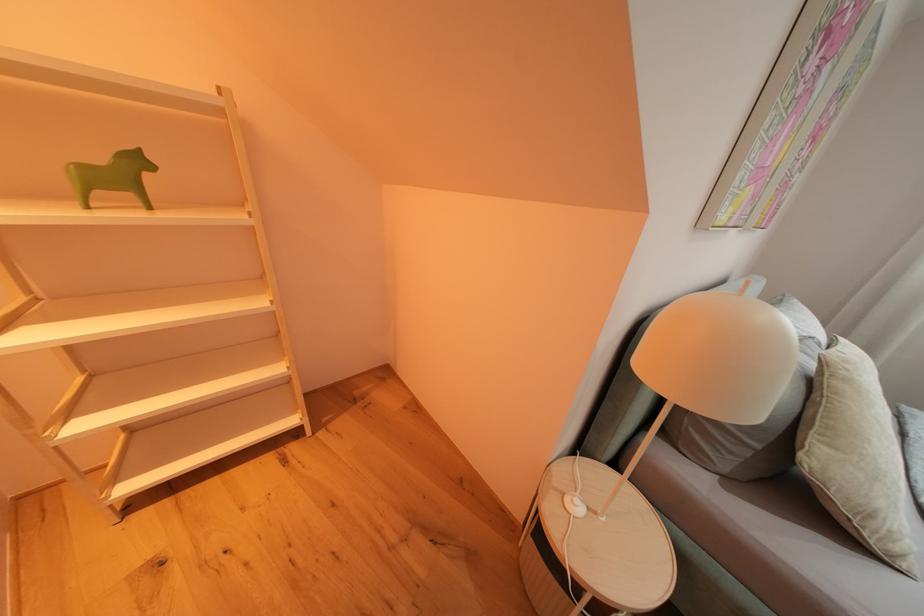
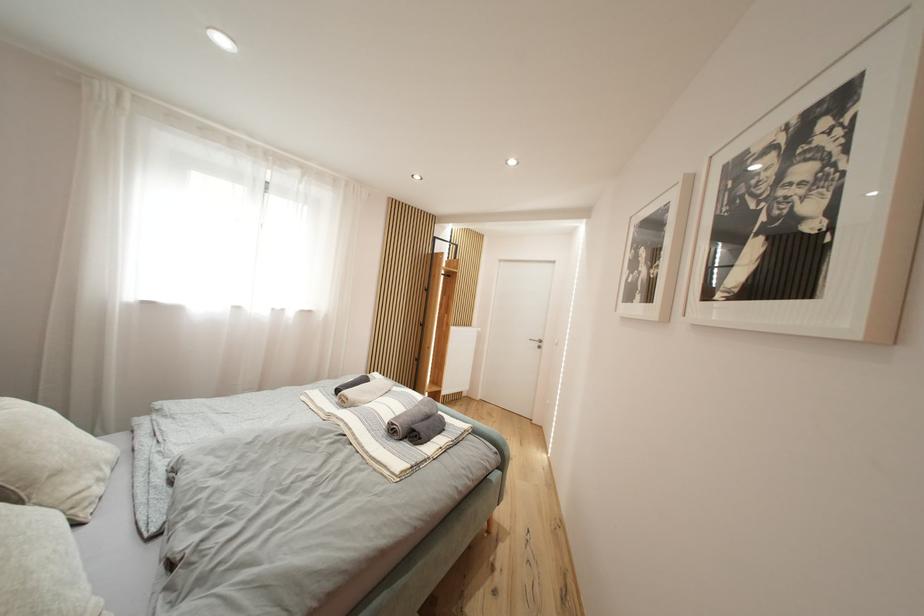
Based on the continuous images, in which direction is the camera rotating?

The camera rotated toward right-down.